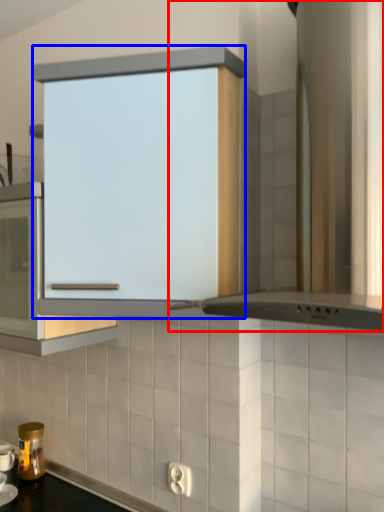
Question: Which of the following is the closest to the observer, home appliance (highlighted by a red box) or cabinetry (highlighted by a blue box)?

Choices:
 (A) home appliance
 (B) cabinetry

Answer: (A)